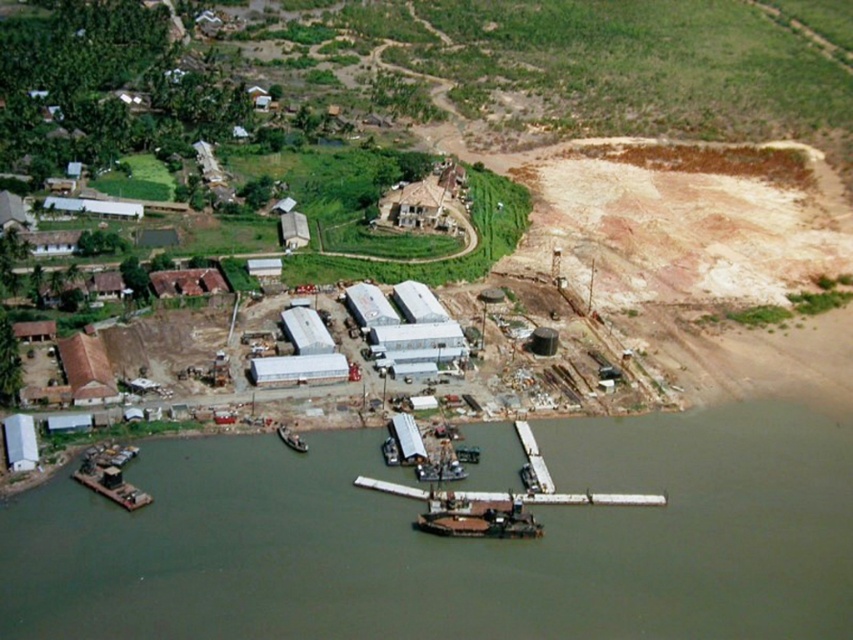
Question: Which point appears farthest from the camera in this image?

Choices:
 (A) (627, 497)
 (B) (296, 445)
 (C) (479, 506)

Answer: (B)

Question: From the image, what is the correct spatial relationship of white matte dock at lower center in relation to wooden dock at lower center?

Choices:
 (A) right
 (B) left

Answer: (B)

Question: Considering the relative positions of metallic gray barge at lower center and wooden dock at lower center in the image provided, where is metallic gray barge at lower center located with respect to wooden dock at lower center?

Choices:
 (A) below
 (B) above

Answer: (A)

Question: Where is metallic gray barge at lower center located in relation to metallic gray boat at lower center in the image?

Choices:
 (A) left
 (B) right

Answer: (B)

Question: Which object is the closest to the metallic gray boat at lower center?

Choices:
 (A) white matte dock at lower center
 (B) wooden dock at lower center
 (C) brown muddy water at lower center
 (D) metallic gray barge at lower center

Answer: (A)

Question: Among these points, which one is farthest from the camera?

Choices:
 (A) (753, 470)
 (B) (532, 442)
 (C) (432, 518)

Answer: (B)